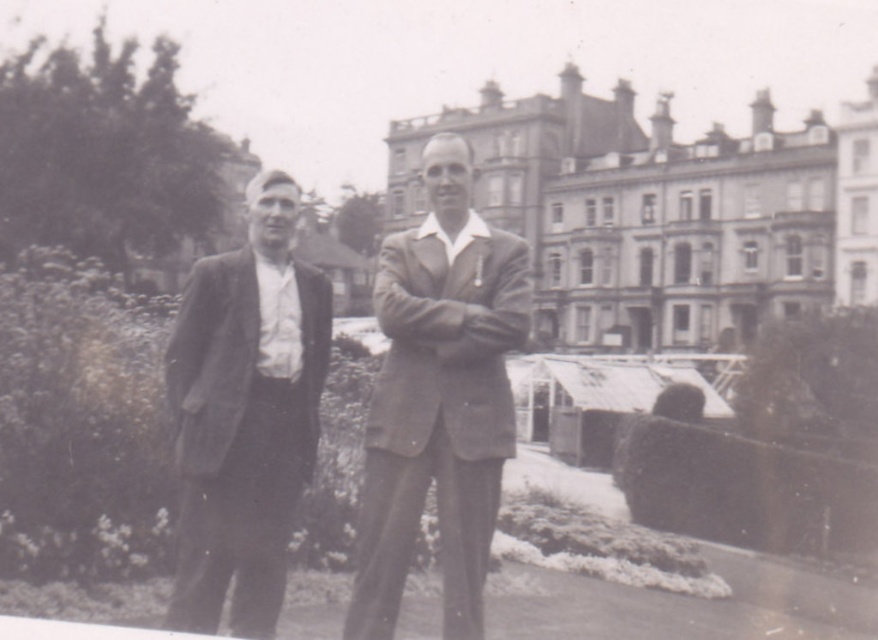
This screenshot has height=640, width=878. What do you see at coordinates (439, 397) in the screenshot?
I see `smooth brown suit at center` at bounding box center [439, 397].

Looking at this image, measure the distance between point (419, 241) and camera.

171.66 feet

Between point (363, 516) and point (193, 596), which one is positioned behind?

Positioned behind is point (363, 516).

In order to click on smooth brown suit at center in this screenshot , I will do `click(439, 397)`.